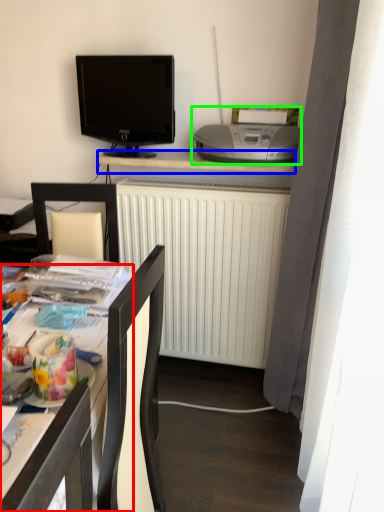
Question: Considering the real-world distances, which object is farthest from desk (highlighted by a red box)? desk (highlighted by a blue box) or printer (highlighted by a green box)?

Choices:
 (A) desk
 (B) printer

Answer: (A)